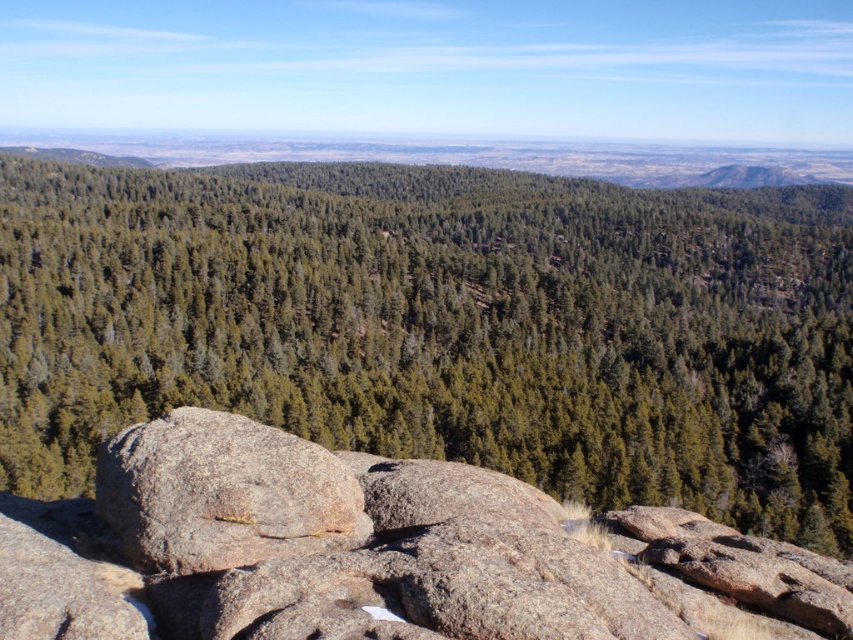
You are a hiker carrying a backpack weighing 15 kilograms. You need to cross the gap between the gray granite rock at center and the gray rough boulder at center. The maximum distance you can jump is 2 meters. Can you safely make the jump?

The distance between the gray granite rock at center and the gray rough boulder at center is 2.88 meters, which exceeds your maximum jump distance of 2 meters. Therefore, you cannot safely make the jump.

You are a hiker standing at the base of the gray granite rock at center and want to reach the green matte forest at center. Which direction should you move to get there?

The green matte forest at center is located above the gray granite rock at center, so you should move upward to reach it.

You are standing at the edge of the forest and see the gray rough boulder at center and the green matte forest at center. Which object is positioned to the right of the other?

The green matte forest at center is positioned to the right of the gray rough boulder at center.